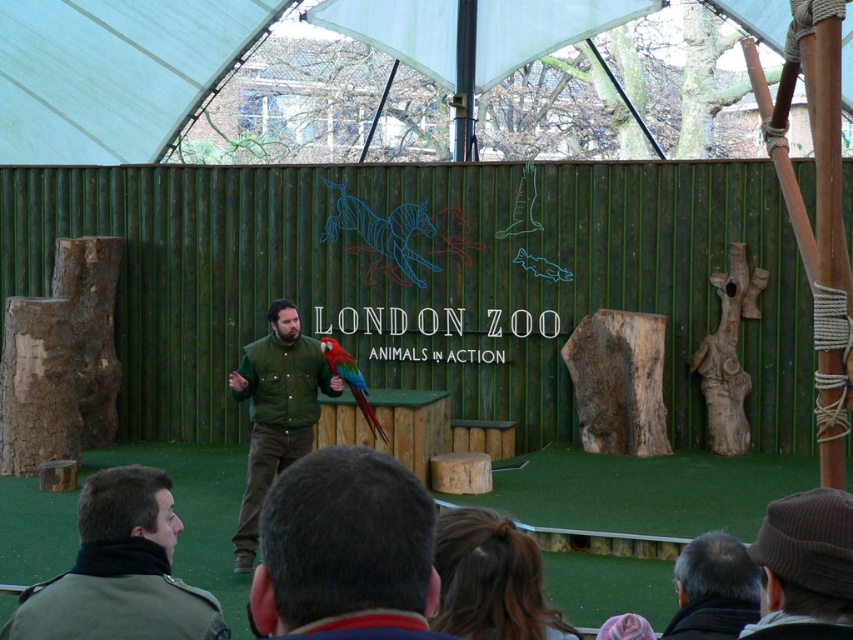
Question: Among these objects, which one is farthest from the camera?

Choices:
 (A) shiny multicolored parrot at center
 (B) white fabric canopy at upper center
 (C) green matte jacket at lower left
 (D) gray hair at lower right

Answer: (B)

Question: Can you confirm if brown knitted hat at upper right is positioned above green matte vest at center?

Choices:
 (A) yes
 (B) no

Answer: (A)

Question: Which point is farther from the camera taking this photo?

Choices:
 (A) (352, 362)
 (B) (779, 32)
 (C) (695, 616)

Answer: (B)

Question: Is green matte jacket at lower left below brown knitted hat at upper right?

Choices:
 (A) no
 (B) yes

Answer: (B)

Question: Does green matte vest at center appear under gray hair at lower right?

Choices:
 (A) no
 (B) yes

Answer: (A)

Question: Which point is closer to the camera?

Choices:
 (A) dark brown hair at lower center
 (B) green matte vest at center
 (C) gray hair at lower right
 (D) shiny multicolored parrot at center

Answer: (A)